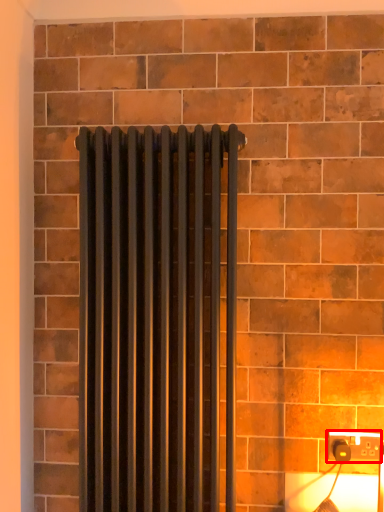
Question: Observing the image, what is the correct spatial positioning of power plugs and sockets (annotated by the red box) in reference to radiator?

Choices:
 (A) right
 (B) left

Answer: (A)